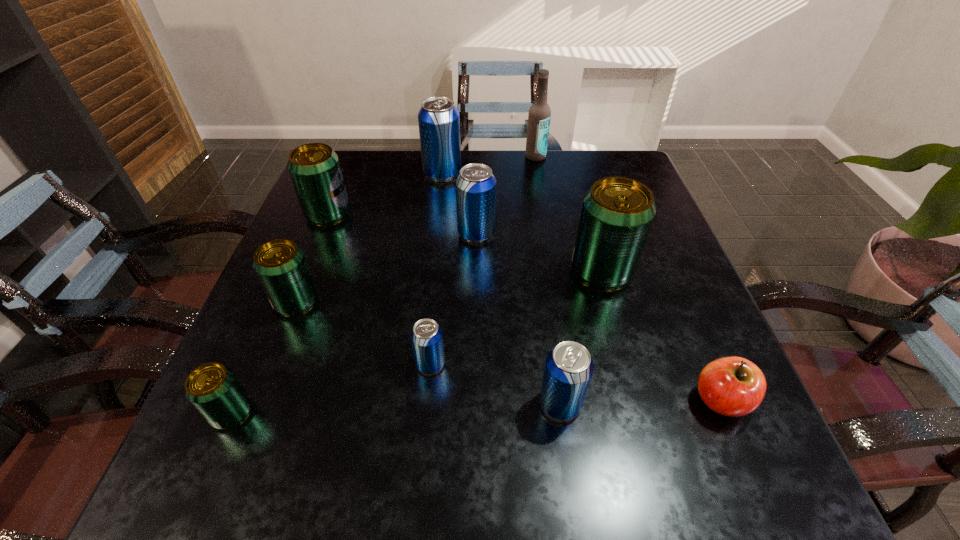
You are a GUI agent. You are given a task and a screenshot of the screen. Output one action in this format:
    pyautogui.click(x=<x>, y=<y>)
    Task: Click on the farthest object
    Image resolution: width=960 pixels, height=540 pixels.
    Given the screenshot: What is the action you would take?
    pyautogui.click(x=539, y=116)

You are a GUI agent. You are given a task and a screenshot of the screen. Output one action in this format:
    pyautogui.click(x=<x>, y=<y>)
    Task: Click on the tallest object
    This screenshot has height=540, width=960.
    Given the screenshot: What is the action you would take?
    pyautogui.click(x=539, y=116)

Locate an element on the screen. The height and width of the screenshot is (540, 960). the farthest beer can is located at coordinates (x=438, y=119).

Where is `the farthest blue beer can`? This screenshot has height=540, width=960. the farthest blue beer can is located at coordinates (438, 119).

The image size is (960, 540). Identify the location of the biggest green beer can. (617, 213).

The height and width of the screenshot is (540, 960). In order to click on the rightmost beer can in this screenshot , I will do `click(617, 213)`.

Find the location of `the farthest green beer can`. the farthest green beer can is located at coordinates (314, 168).

The image size is (960, 540). Find the location of `the third smallest blue beer can`. the third smallest blue beer can is located at coordinates [x=475, y=185].

Where is `the third biggest green beer can`? The image size is (960, 540). the third biggest green beer can is located at coordinates (280, 265).

At what (x,y) coordinates should I click in order to perform the action: click on the third biggest blue beer can. Please return your answer as a coordinate pair (x, y). The width and height of the screenshot is (960, 540). Looking at the image, I should click on (568, 370).